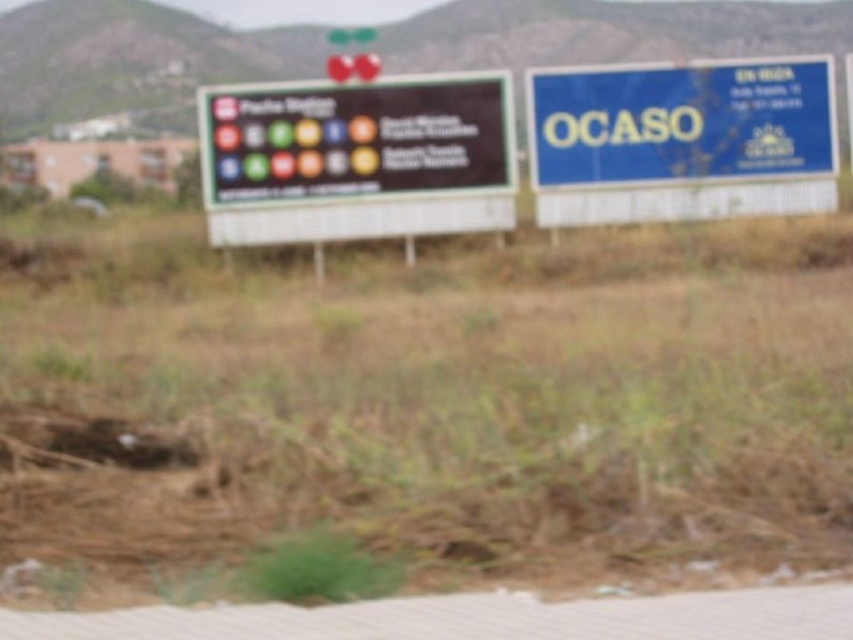
Question: Which point appears farthest from the camera in this image?

Choices:
 (A) tap(469, 152)
 (B) tap(711, 124)

Answer: (B)

Question: Among these objects, which one is nearest to the camera?

Choices:
 (A) blue plastic signboard at upper right
 (B) black matte sign at center

Answer: (B)

Question: Observing the image, what is the correct spatial positioning of black matte sign at center in reference to blue plastic signboard at upper right?

Choices:
 (A) below
 (B) above

Answer: (A)

Question: Can you confirm if black matte sign at center is wider than blue plastic signboard at upper right?

Choices:
 (A) yes
 (B) no

Answer: (B)

Question: In this image, where is black matte sign at center located relative to blue plastic signboard at upper right?

Choices:
 (A) right
 (B) left

Answer: (B)

Question: Which point is farther to the camera?

Choices:
 (A) (643, 173)
 (B) (273, 122)

Answer: (A)